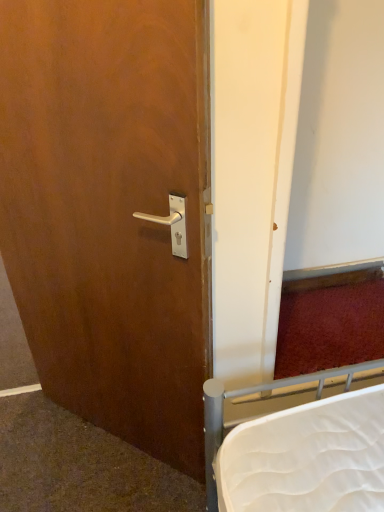
This screenshot has height=512, width=384. What do you see at coordinates (110, 210) in the screenshot?
I see `matte wood door at center` at bounding box center [110, 210].

Identify the location of matte wood door at center. The height and width of the screenshot is (512, 384). (110, 210).

Measure the distance between point (114, 125) and camera.

Point (114, 125) is 89.40 centimeters away from camera.

Where is `matte wood door at center`? The width and height of the screenshot is (384, 512). matte wood door at center is located at coordinates (110, 210).